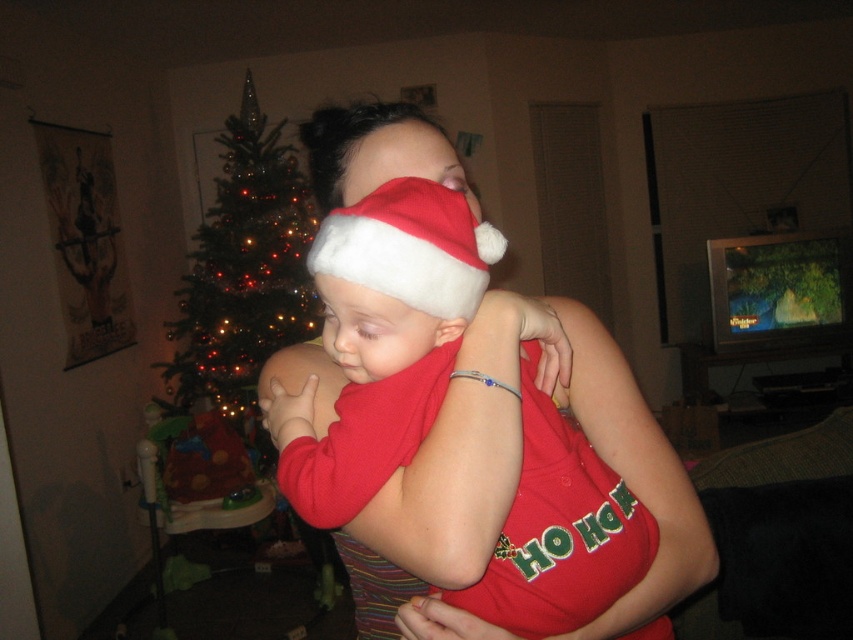
Question: Is green artificial christmas tree at left positioned in front of white fluffy santa hat at center?

Choices:
 (A) yes
 (B) no

Answer: (B)

Question: Which object is positioned closest to the green artificial christmas tree at left?

Choices:
 (A) white fluffy santa hat at center
 (B) matte red santa hat at center

Answer: (B)

Question: Where is matte red santa hat at center located in relation to white fluffy santa hat at center in the image?

Choices:
 (A) right
 (B) left

Answer: (A)

Question: Observing the image, what is the correct spatial positioning of matte red santa hat at center in reference to white fluffy santa hat at center?

Choices:
 (A) above
 (B) below

Answer: (B)

Question: Which point is closer to the camera?

Choices:
 (A) (447, 228)
 (B) (518, 449)

Answer: (A)

Question: Which point appears closest to the camera in this image?

Choices:
 (A) (503, 636)
 (B) (222, 355)
 (C) (386, 204)

Answer: (C)